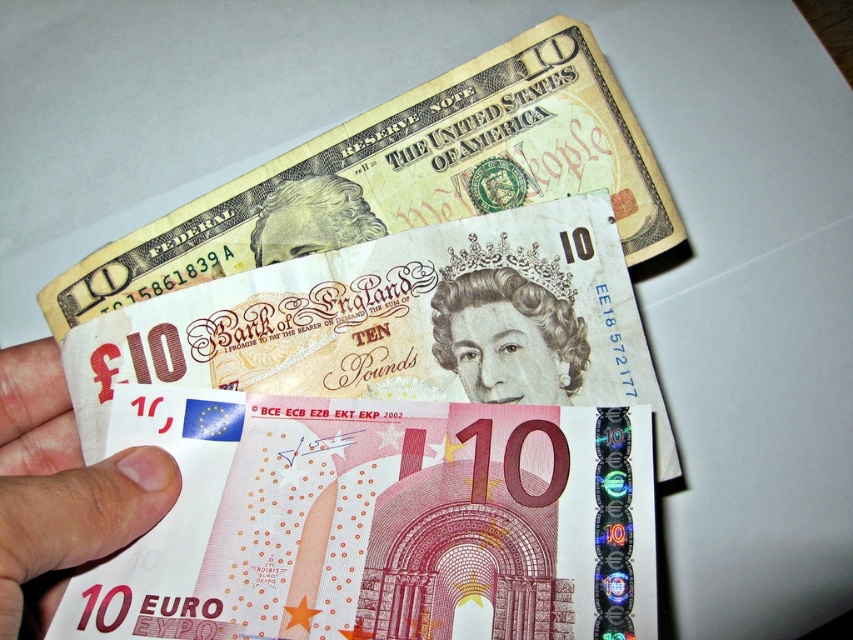
You are a currency collector who wants to place a new banknote between the smooth paper banknote at upper center and the matte yellow paper at upper center. Can you fit it there?

The distance between the smooth paper banknote at upper center and the matte yellow paper at upper center is 7.74 centimeters. If the new banknote is narrower than this distance, it can fit.

You are organizing a collection of banknotes and notice two items in the image. One is a matte paper money at lower left and the other is a smooth paper portrait at center. Which one is covering part of the other?

The matte paper money at lower left is in front of the smooth paper portrait at center, so it is covering part of the smooth paper portrait at center.

You are a currency collector examining the U.S. dollar bill. You notice two elements on the bill. One is the smooth paper banknote at upper center, and the other is the smooth paper portrait at center. Which of these two elements is bigger in size?

The smooth paper banknote at upper center is larger in size than the smooth paper portrait at center.